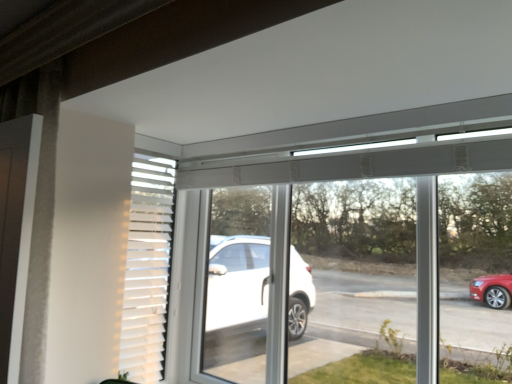
Question: Considering the relative positions of transparent glass window at center and white matte shutter at upper center in the image provided, is transparent glass window at center to the right of white matte shutter at upper center from the viewer's perspective?

Choices:
 (A) no
 (B) yes

Answer: (B)

Question: Can you confirm if transparent glass window at center is shorter than white matte shutter at upper center?

Choices:
 (A) yes
 (B) no

Answer: (B)

Question: From the image's perspective, is transparent glass window at center beneath white matte shutter at upper center?

Choices:
 (A) yes
 (B) no

Answer: (A)

Question: Is transparent glass window at center positioned far away from white matte shutter at upper center?

Choices:
 (A) no
 (B) yes

Answer: (A)

Question: Does transparent glass window at center come behind white matte shutter at upper center?

Choices:
 (A) no
 (B) yes

Answer: (A)

Question: Could you tell me if transparent glass window at center is facing white matte shutter at upper center?

Choices:
 (A) yes
 (B) no

Answer: (A)

Question: Is white matte shutter at upper center turned away from transparent glass window at center?

Choices:
 (A) no
 (B) yes

Answer: (A)

Question: Is transparent glass window at center inside white matte shutter at upper center?

Choices:
 (A) yes
 (B) no

Answer: (B)

Question: Is white matte shutter at upper center bigger than transparent glass window at center?

Choices:
 (A) yes
 (B) no

Answer: (B)

Question: Is white matte shutter at upper center beside transparent glass window at center?

Choices:
 (A) yes
 (B) no

Answer: (B)

Question: Is white matte shutter at upper center positioned far away from transparent glass window at center?

Choices:
 (A) no
 (B) yes

Answer: (A)

Question: From the image's perspective, would you say white matte shutter at upper center is shown under transparent glass window at center?

Choices:
 (A) yes
 (B) no

Answer: (B)

Question: Is white matte shutter at upper center inside the boundaries of transparent glass window at center, or outside?

Choices:
 (A) outside
 (B) inside

Answer: (B)